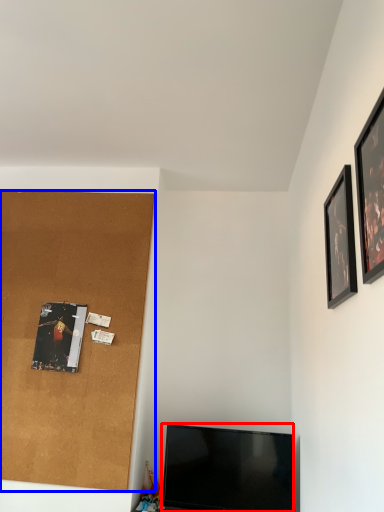
Question: Which object appears closest to the camera in this image, television (highlighted by a red box) or plywood (highlighted by a blue box)?

Choices:
 (A) television
 (B) plywood

Answer: (A)